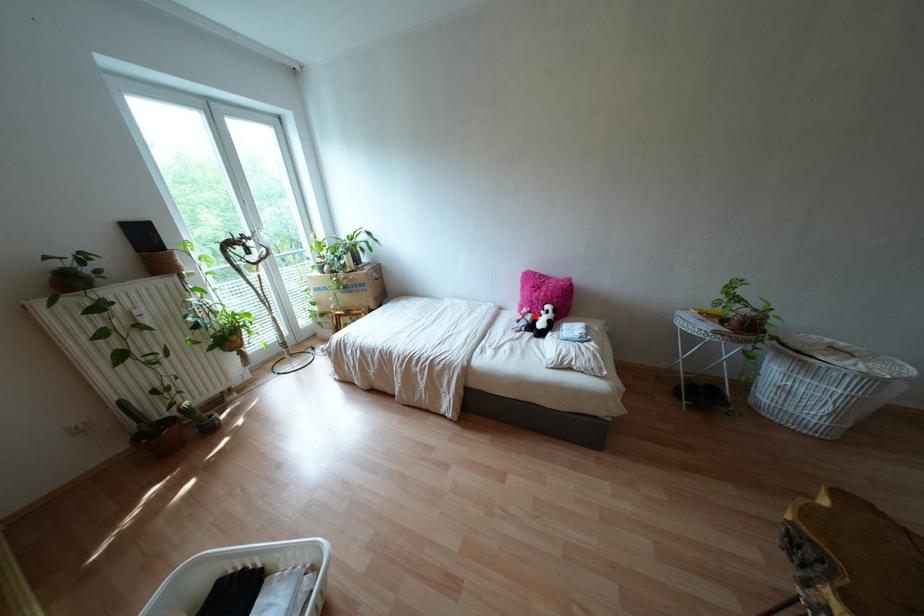
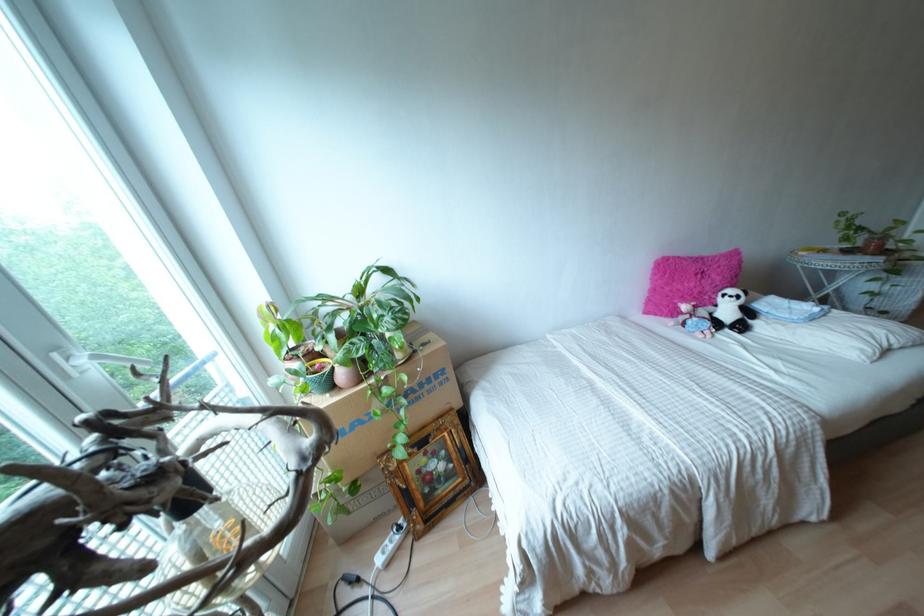
Question: I am providing you with two images of the same scene from different viewpoints. In image1, a red point is highlighted. Considering the same 3D point in image2, which of the following is correct?

Choices:
 (A) It is closer
 (B) It is farther

Answer: (B)